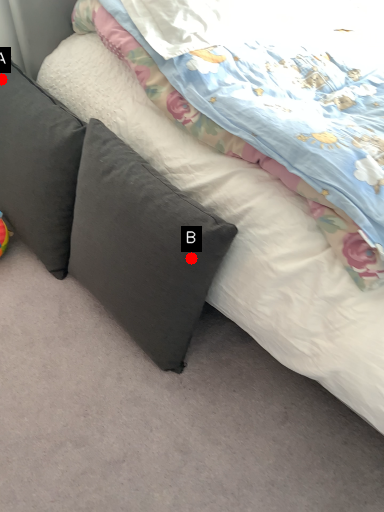
Question: Two points are circled on the image, labeled by A and B beside each circle. Which point is closer to the camera taking this photo?

Choices:
 (A) A is closer
 (B) B is closer

Answer: (B)